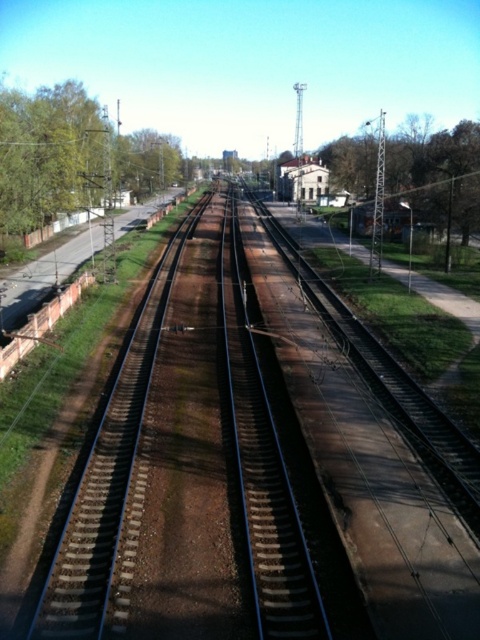
Question: Which of the following is the closest to the observer?

Choices:
 (A) green leafy tree at left
 (B) green leafy tree at center

Answer: (B)

Question: Among these objects, which one is farthest from the camera?

Choices:
 (A) green leafy tree at center
 (B) green leafy tree at left

Answer: (B)

Question: Is the position of green leafy tree at left less distant than that of green leafy tree at center?

Choices:
 (A) no
 (B) yes

Answer: (A)

Question: Does green leafy tree at left appear on the left side of green leafy tree at center?

Choices:
 (A) yes
 (B) no

Answer: (A)

Question: Which object is closer to the camera taking this photo?

Choices:
 (A) green leafy tree at center
 (B) green leafy tree at left

Answer: (A)

Question: Is green leafy tree at left to the left of green leafy tree at center from the viewer's perspective?

Choices:
 (A) yes
 (B) no

Answer: (A)